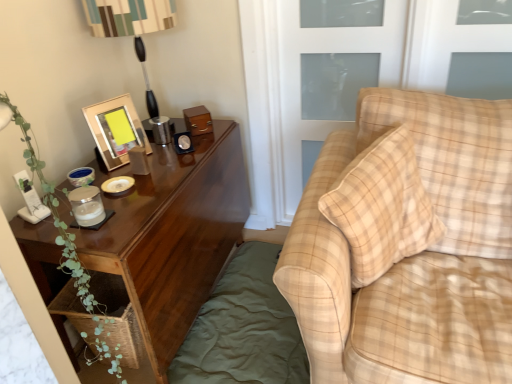
This screenshot has width=512, height=384. Find the location of `transparent glass door at upper right`. transparent glass door at upper right is located at coordinates (443, 42).

Describe the element at coordinates (174, 236) in the screenshot. I see `shiny brown wood nightstand at left` at that location.

The width and height of the screenshot is (512, 384). Identify the location of plaid fabric couch at right. (413, 256).

This screenshot has width=512, height=384. What do you see at coordinates (116, 130) in the screenshot?
I see `woodenobject at upper left` at bounding box center [116, 130].

Locate an element on the screen. The height and width of the screenshot is (384, 512). transparent glass door at upper right is located at coordinates (443, 42).

Is shiny brown wood nightstand at left to the left or to the right of transparent glass door at upper right in the image?

shiny brown wood nightstand at left is to the left of transparent glass door at upper right.

The height and width of the screenshot is (384, 512). What are the coordinates of `nightstand located below the transparent glass door at upper right (from the image's perspective)` in the screenshot? It's located at (174, 236).

Which object is wider, shiny brown wood nightstand at left or transparent glass door at upper right?

shiny brown wood nightstand at left.

From the image's perspective, is shiny brown wood nightstand at left located beneath transparent glass door at upper right?

Correct, shiny brown wood nightstand at left appears lower than transparent glass door at upper right in the image.

Considering the positions of objects transparent glass door at upper right and woodenobject at upper left in the image provided, who is more to the left, transparent glass door at upper right or woodenobject at upper left?

Positioned to the left is woodenobject at upper left.

Is transparent glass door at upper right wider or thinner than woodenobject at upper left?

Considering their sizes, transparent glass door at upper right looks slimmer than woodenobject at upper left.

Is transparent glass door at upper right surrounding woodenobject at upper left?

Definitely not — woodenobject at upper left is not inside transparent glass door at upper right.

Is plaid fabric couch at right not close to woodenobject at upper left?

plaid fabric couch at right is near woodenobject at upper left, not far away.

Which object is positioned more to the right, plaid fabric couch at right or woodenobject at upper left?

From the viewer's perspective, plaid fabric couch at right appears more on the right side.

In the scene shown: From the image's perspective, which is below, plaid fabric couch at right or woodenobject at upper left?

plaid fabric couch at right appears lower in the image.

Is plaid fabric couch at right situated inside woodenobject at upper left or outside?

The correct answer is: outside.

Considering the relative sizes of plaid fabric couch at right and green cotton bedding at lower left in the image provided, is plaid fabric couch at right thinner than green cotton bedding at lower left?

Incorrect, the width of plaid fabric couch at right is not less than that of green cotton bedding at lower left.

From a real-world perspective, does plaid fabric couch at right stand above green cotton bedding at lower left?

Yes, from a real-world perspective, plaid fabric couch at right is above green cotton bedding at lower left.

Is plaid fabric couch at right inside or outside of green cotton bedding at lower left?

plaid fabric couch at right is spatially situated outside green cotton bedding at lower left.

Looking at this image, measure the distance between green cotton bedding at lower left and green leafy plant at left.

green cotton bedding at lower left is 76.94 centimeters from green leafy plant at left.

Based on the photo, considering the relative sizes of green cotton bedding at lower left and green leafy plant at left in the image provided, is green cotton bedding at lower left bigger than green leafy plant at left?

No.

Is green cotton bedding at lower left directly adjacent to green leafy plant at left?

They are not placed beside each other.

Considering the relative positions of green cotton bedding at lower left and green leafy plant at left in the image provided, is green cotton bedding at lower left to the left of green leafy plant at left from the viewer's perspective?

In fact, green cotton bedding at lower left is to the right of green leafy plant at left.

From a real-world perspective, between green cotton bedding at lower left and wooden table lamp at upper left, who is vertically higher?

From a 3D spatial view, wooden table lamp at upper left is above.

Does green cotton bedding at lower left have a lesser width compared to wooden table lamp at upper left?

No.

Is green cotton bedding at lower left oriented away from wooden table lamp at upper left?

No, green cotton bedding at lower left is not facing the opposite direction of wooden table lamp at upper left.

How many degrees apart are the facing directions of green cotton bedding at lower left and wooden table lamp at upper left?

There is a 90.1-degree angle between the facing directions of green cotton bedding at lower left and wooden table lamp at upper left.

Can you confirm if woodenobject at upper left is taller than plaid fabric couch at right?

In fact, woodenobject at upper left may be shorter than plaid fabric couch at right.

Is point (112, 110) closer or farther from the camera than point (441, 312)?

Clearly, point (112, 110) is more distant from the camera than point (441, 312).

Is woodenobject at upper left in front of or behind plaid fabric couch at right in the image?

woodenobject at upper left is positioned farther from the viewer than plaid fabric couch at right.

Are woodenobject at upper left and plaid fabric couch at right beside each other?

woodenobject at upper left and plaid fabric couch at right are not in contact.

Where is `window lying behind the shiny brown wood nightstand at left`? Image resolution: width=512 pixels, height=384 pixels. window lying behind the shiny brown wood nightstand at left is located at coordinates (443, 42).

This screenshot has width=512, height=384. I want to click on window that is above the woodenobject at upper left (from the image's perspective), so pyautogui.click(x=443, y=42).

Based on their spatial positions, is woodenobject at upper left or green leafy plant at left further from green cotton bedding at lower left?

woodenobject at upper left.

When comparing their distances from green cotton bedding at lower left, does wooden table lamp at upper left or woodenobject at upper left seem closer?

woodenobject at upper left is closer to green cotton bedding at lower left.

From the picture: Based on their spatial positions, is green leafy plant at left or shiny brown wood nightstand at left closer to transparent glass door at upper right?

Among the two, shiny brown wood nightstand at left is located nearer to transparent glass door at upper right.

Looking at the image, which one is located further to wooden table lamp at upper left, green leafy plant at left or woodenobject at upper left?

Based on the image, green leafy plant at left appears to be further to wooden table lamp at upper left.

Based on their spatial positions, is green leafy plant at left or transparent glass door at upper right closer to woodenobject at upper left?

green leafy plant at left is closer to woodenobject at upper left.

Estimate the real-world distances between objects in this image. Which object is further from woodenobject at upper left, clear glass screen door at upper right or plaid fabric couch at right?

plaid fabric couch at right.

From the image, which object appears to be nearer to green cotton bedding at lower left, woodenobject at upper left or plaid fabric couch at right?

plaid fabric couch at right lies closer to green cotton bedding at lower left than the other object.

Considering their positions, is plaid fabric couch at right positioned closer to green cotton bedding at lower left than green leafy plant at left?

plaid fabric couch at right.

I want to click on bedding located between wooden table lamp at upper left and transparent glass door at upper right in the left-right direction, so click(x=244, y=328).

Find the location of a particular element. Image resolution: width=512 pixels, height=384 pixels. screen door between woodenobject at upper left and transparent glass door at upper right from left to right is located at coordinates (329, 74).

Locate an element on the screen. The width and height of the screenshot is (512, 384). nightstand between wooden table lamp at upper left and transparent glass door at upper right is located at coordinates (174, 236).

You are a GUI agent. You are given a task and a screenshot of the screen. Output one action in this format:
    pyautogui.click(x=<x>, y=<y>)
    Task: Click on the nightstand between green leafy plant at left and transparent glass door at upper right in the horizontal direction
    The width and height of the screenshot is (512, 384).
    Given the screenshot: What is the action you would take?
    pyautogui.click(x=174, y=236)